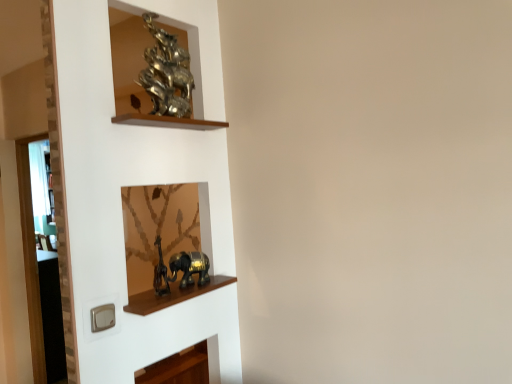
Question: From a real-world perspective, is metallic gold elephant at center, which is the 1th cabinet from bottom to top, located beneath gold metallic elephant at lower center, the 1th art when ordered from bottom to top?

Choices:
 (A) no
 (B) yes

Answer: (B)

Question: Can you confirm if metallic gold elephant at center, which is the 1th cabinet from bottom to top, is positioned to the left of gold metallic elephant at lower center, acting as the 2th art starting from the top?

Choices:
 (A) no
 (B) yes

Answer: (B)

Question: Is metallic gold elephant at center, placed as the second cabinet when sorted from top to bottom, facing towards gold metallic elephant at lower center, the 1th art when ordered from bottom to top?

Choices:
 (A) no
 (B) yes

Answer: (A)

Question: Considering the relative positions of metallic gold elephant at center, placed as the second cabinet when sorted from top to bottom, and gold metallic elephant at lower center, the 1th art when ordered from bottom to top, in the image provided, is metallic gold elephant at center, placed as the second cabinet when sorted from top to bottom, to the right of gold metallic elephant at lower center, the 1th art when ordered from bottom to top, from the viewer's perspective?

Choices:
 (A) yes
 (B) no

Answer: (B)

Question: From a real-world perspective, is metallic gold elephant at center, which is the 1th cabinet from bottom to top, over gold metallic elephant at lower center, the 1th art when ordered from bottom to top?

Choices:
 (A) no
 (B) yes

Answer: (A)

Question: Can you confirm if metallic gold elephant at center, which is the 1th cabinet from bottom to top, is taller than gold metallic elephant at lower center, acting as the 2th art starting from the top?

Choices:
 (A) no
 (B) yes

Answer: (A)

Question: Is metallic gold elephant at center, which is the 1th cabinet from bottom to top, closer to the viewer compared to wooden shelf at upper center, marked as the first cabinet in a top-to-bottom arrangement?

Choices:
 (A) no
 (B) yes

Answer: (A)

Question: Does metallic gold elephant at center, placed as the second cabinet when sorted from top to bottom, touch wooden shelf at upper center, the 2th cabinet ordered from the bottom?

Choices:
 (A) yes
 (B) no

Answer: (B)

Question: Does metallic gold elephant at center, placed as the second cabinet when sorted from top to bottom, have a larger size compared to wooden shelf at upper center, marked as the first cabinet in a top-to-bottom arrangement?

Choices:
 (A) no
 (B) yes

Answer: (A)

Question: Is the position of metallic gold elephant at center, which is the 1th cabinet from bottom to top, more distant than that of wooden shelf at upper center, marked as the first cabinet in a top-to-bottom arrangement?

Choices:
 (A) yes
 (B) no

Answer: (A)

Question: From a real-world perspective, is metallic gold elephant at center, which is the 1th cabinet from bottom to top, on wooden shelf at upper center, the 2th cabinet ordered from the bottom?

Choices:
 (A) no
 (B) yes

Answer: (A)

Question: Is metallic gold elephant at center, placed as the second cabinet when sorted from top to bottom, completely or partially outside of wooden shelf at upper center, marked as the first cabinet in a top-to-bottom arrangement?

Choices:
 (A) no
 (B) yes

Answer: (B)

Question: Can you confirm if wooden shelf at upper center, the 2th cabinet ordered from the bottom, is shorter than shiny metallic sculpture at upper left, which is the 2th art in bottom-to-top order?

Choices:
 (A) no
 (B) yes

Answer: (B)